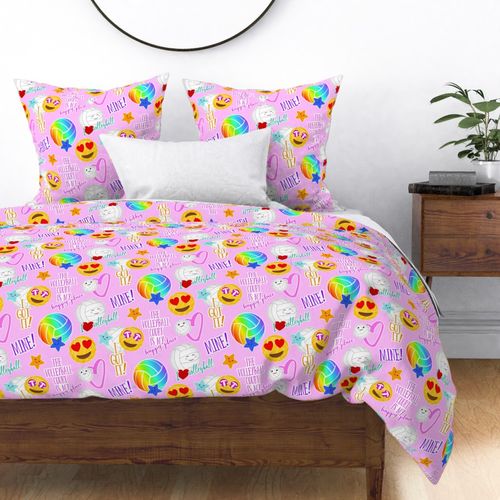
Find the location of a particular element. white wall is located at coordinates (378, 154).